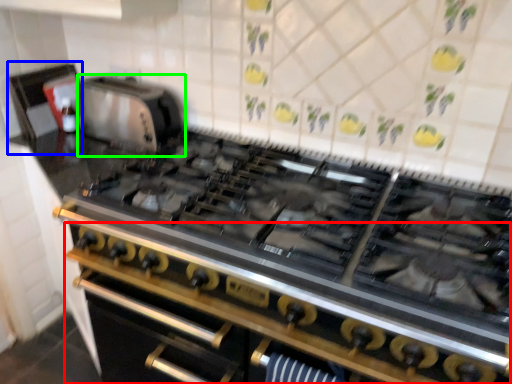
Question: Which object is positioned farthest from oven (highlighted by a red box)? Select from appliance (highlighted by a blue box) and appliance (highlighted by a green box).

Choices:
 (A) appliance
 (B) appliance

Answer: (A)